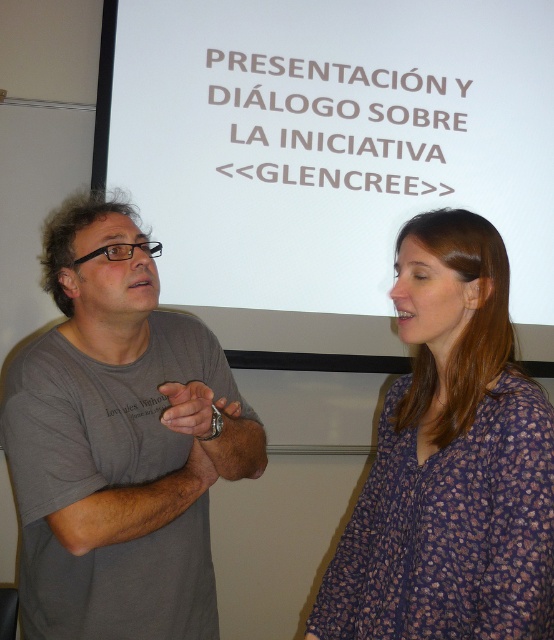
Can you confirm if gray cotton t-shirt at left is wider than purple floral blouse at center?

Yes.

From the picture: Is gray cotton t-shirt at left smaller than purple floral blouse at center?

Incorrect, gray cotton t-shirt at left is not smaller in size than purple floral blouse at center.

Does point (45, 221) come behind point (489, 592)?

Yes, it is.

At what (x,y) coordinates should I click in order to perform the action: click on gray cotton t-shirt at left. Please return your answer as a coordinate pair (x, y). This screenshot has height=640, width=554. Looking at the image, I should click on (119, 442).

Is white matte projection screen at upper center further to the viewer compared to purple floral blouse at center?

Yes, white matte projection screen at upper center is further from the viewer.

Is white matte projection screen at upper center positioned before purple floral blouse at center?

That is False.

Describe the element at coordinates (326, 140) in the screenshot. I see `white matte projection screen at upper center` at that location.

Find the location of a particular element. This screenshot has width=554, height=640. white matte projection screen at upper center is located at coordinates (326, 140).

Is white matte projection screen at upper center shorter than gray cotton t-shirt at left?

No.

Locate an element on the screen. This screenshot has width=554, height=640. white matte projection screen at upper center is located at coordinates (326, 140).

Describe the element at coordinates (326, 140) in the screenshot. I see `white matte projection screen at upper center` at that location.

You are a GUI agent. You are given a task and a screenshot of the screen. Output one action in this format:
    pyautogui.click(x=<x>, y=<y>)
    Task: Click on the white matte projection screen at upper center
    This screenshot has height=640, width=554.
    Given the screenshot: What is the action you would take?
    pyautogui.click(x=326, y=140)